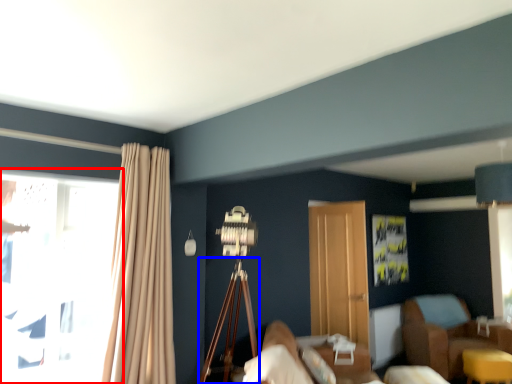
Question: Which of the following is the closest to the observer, window (highlighted by a red box) or tripod (highlighted by a blue box)?

Choices:
 (A) window
 (B) tripod

Answer: (A)